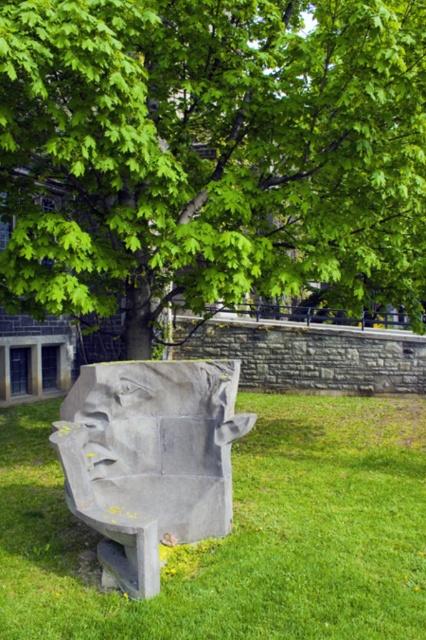
You are a photographer trying to capture a wide shot of the gray stone face at lower left and the green leafy tree at upper center. Based on their sizes, which object would appear larger in the photo?

The green leafy tree at upper center might be wider than the gray stone face at lower left, so it could appear larger in the photo.

You are standing in front of the stone sculpture and notice the green leafy tree at upper center and the green grass at center. Which object is higher up in the image?

The green leafy tree at upper center is located above the green grass at center, so it is higher up in the image.

You are a landscape architect designing a garden. You need to place a new statue that requires a space larger than the area occupied by the green grass at center. Can the area under the green leafy tree at upper center accommodate this statue?

The green leafy tree at upper center is larger in size than the green grass at center, so the area under the green leafy tree at upper center can accommodate the statue since it has a larger space available.